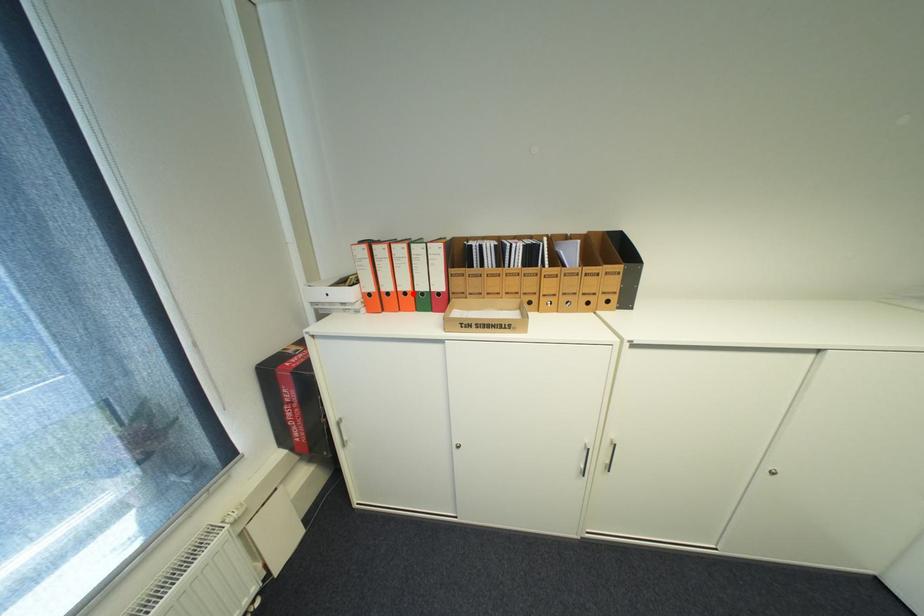
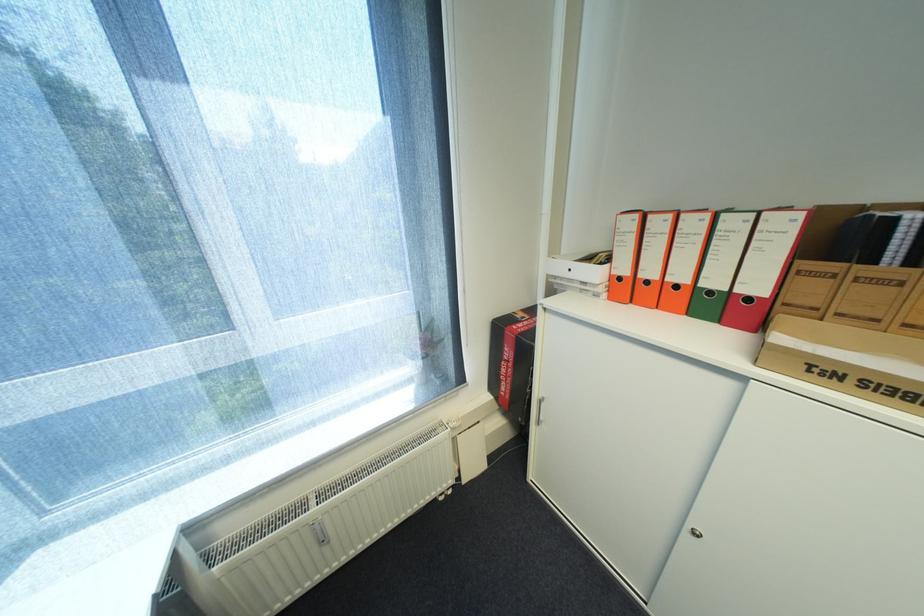
Question: I am providing you with two images of the same scene from different viewpoints. A red point is marked on the first image. At the location where the point appears in image 1, is it still visible in image 2?

Choices:
 (A) Yes
 (B) No

Answer: (A)